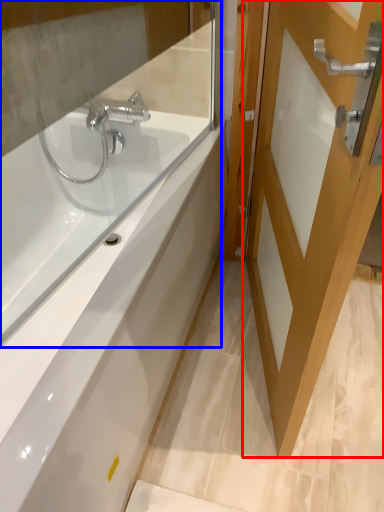
Question: Among these objects, which one is farthest to the camera, door (highlighted by a red box) or mirror (highlighted by a blue box)?

Choices:
 (A) door
 (B) mirror

Answer: (A)